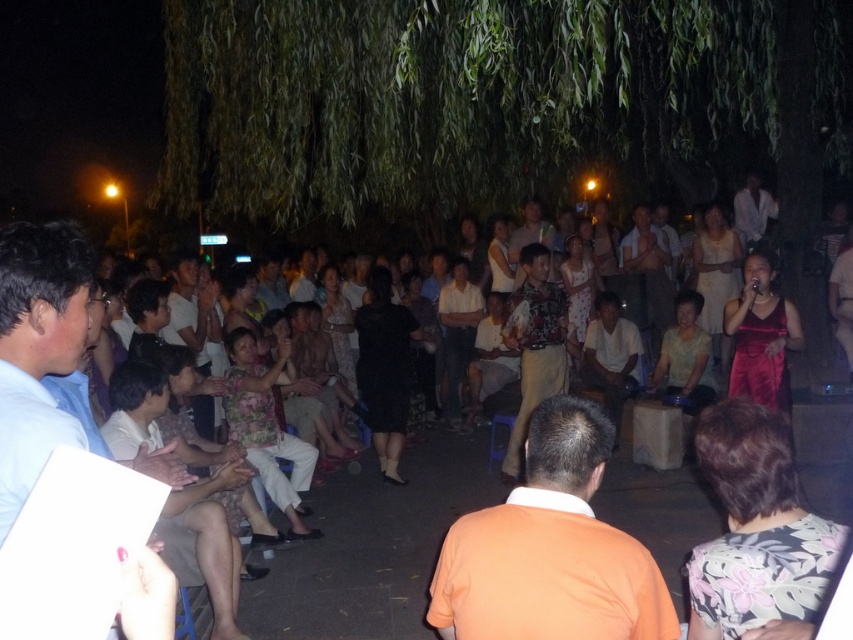
From the picture: Between light blue shirt at left and light brown wood chair at lower left, which one is positioned higher?

light blue shirt at left is higher up.

Does light blue shirt at left have a lesser height compared to light brown wood chair at lower left?

Correct, light blue shirt at left is not as tall as light brown wood chair at lower left.

Who is more distant from viewer, (7, 356) or (224, 465)?

The point (224, 465) is more distant.

Find the location of a particular element. light blue shirt at left is located at coordinates (38, 348).

Is floral dress at center smaller than light blue shirt at left?

No.

Who is more distant from viewer, (410, 536) or (25, 432)?

The point (410, 536) is behind.

Is point (390, 592) positioned in front of point (138, 609)?

No, (390, 592) is further to viewer.

Identify the location of floral dress at center. (373, 547).

Does floral dress at center have a smaller size compared to light brown wood chair at lower left?

Actually, floral dress at center might be larger than light brown wood chair at lower left.

Who is higher up, floral dress at center or light brown wood chair at lower left?

light brown wood chair at lower left

Is point (473, 474) less distant than point (154, 381)?

No, it is not.

This screenshot has width=853, height=640. Find the location of `floral dress at center`. floral dress at center is located at coordinates (373, 547).